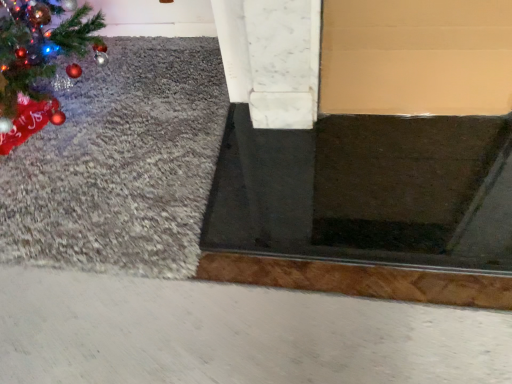
Question: Is the position of black rubber doormat at center less distant than that of gray shag rug at left?

Choices:
 (A) no
 (B) yes

Answer: (B)

Question: Are black rubber doormat at center and gray shag rug at left beside each other?

Choices:
 (A) no
 (B) yes

Answer: (A)

Question: Is gray shag rug at left a part of black rubber doormat at center?

Choices:
 (A) yes
 (B) no

Answer: (B)

Question: From the image's perspective, would you say black rubber doormat at center is positioned over gray shag rug at left?

Choices:
 (A) yes
 (B) no

Answer: (B)

Question: Is black rubber doormat at center thinner than gray shag rug at left?

Choices:
 (A) no
 (B) yes

Answer: (B)

Question: Can you confirm if black rubber doormat at center is shorter than gray shag rug at left?

Choices:
 (A) no
 (B) yes

Answer: (A)

Question: Does gray shag rug at left have a larger size compared to black rubber doormat at center?

Choices:
 (A) no
 (B) yes

Answer: (B)

Question: From a real-world perspective, is gray shag rug at left below black rubber doormat at center?

Choices:
 (A) yes
 (B) no

Answer: (A)

Question: Is gray shag rug at left positioned in front of black rubber doormat at center?

Choices:
 (A) yes
 (B) no

Answer: (B)

Question: Is gray shag rug at left facing towards black rubber doormat at center?

Choices:
 (A) no
 (B) yes

Answer: (B)

Question: Is gray shag rug at left at the left side of black rubber doormat at center?

Choices:
 (A) no
 (B) yes

Answer: (B)

Question: Can black rubber doormat at center be found inside gray shag rug at left?

Choices:
 (A) no
 (B) yes

Answer: (A)

Question: Is gray shag rug at left taller or shorter than black rubber doormat at center?

Choices:
 (A) tall
 (B) short

Answer: (B)